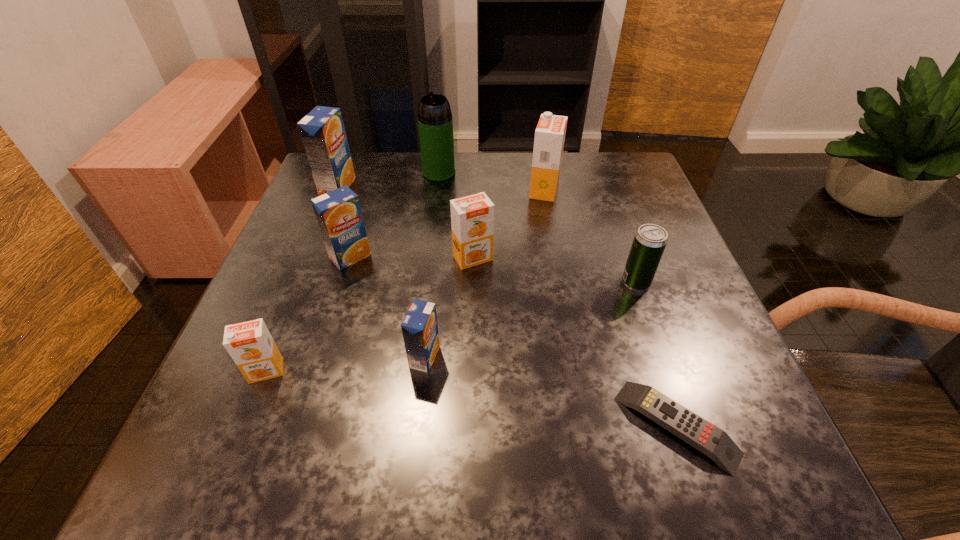
Where is `the fourth nearest object`? the fourth nearest object is located at coordinates [x=650, y=240].

Locate an element on the screen. the fourth orange juice from left to right is located at coordinates (419, 328).

Identify the location of the rightmost blue orange_juice. Image resolution: width=960 pixels, height=540 pixels. click(x=419, y=328).

Identify the location of the smallest orange orange juice. This screenshot has width=960, height=540. (250, 344).

Where is `the nearest orange orange juice`? the nearest orange orange juice is located at coordinates (250, 344).

This screenshot has height=540, width=960. Identify the location of remote control. (715, 443).

The image size is (960, 540). In order to click on yellow remote control in this screenshot , I will do `click(715, 443)`.

In order to click on vacant space located from the spout of the tallest object in this screenshot , I will do `click(425, 287)`.

Find the location of a particular element. The width and height of the screenshot is (960, 540). vacant space situated 0.150m on the right of the farthest blue orange_juice is located at coordinates (415, 186).

I want to click on vacant space located 0.400m on the front of the rightmost orange juice, so click(x=571, y=341).